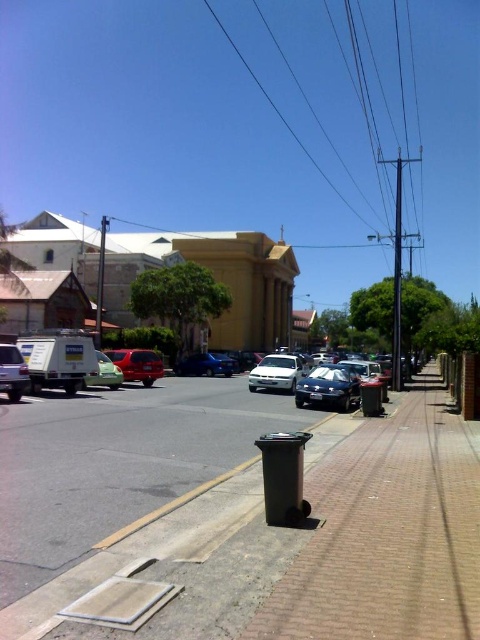
Question: Is shiny blue sedan at center further to camera compared to matte red car at center-left?

Choices:
 (A) yes
 (B) no

Answer: (B)

Question: Is shiny blue sedan at center bigger than green matte car at center-left?

Choices:
 (A) no
 (B) yes

Answer: (B)

Question: Which of the following is the farthest from the observer?

Choices:
 (A) green matte car at center-left
 (B) matte red car at center-left
 (C) white matte sedan at center

Answer: (B)

Question: Which point is farther to the camera?

Choices:
 (A) black metallic power line at upper center
 (B) matte red car at center-left

Answer: (A)

Question: Where is white matte sedan at center located in relation to black metallic power line at upper center in the image?

Choices:
 (A) above
 (B) below

Answer: (B)

Question: Which point appears closest to the camera in this image?

Choices:
 (A) (252, 378)
 (B) (104, 385)

Answer: (B)